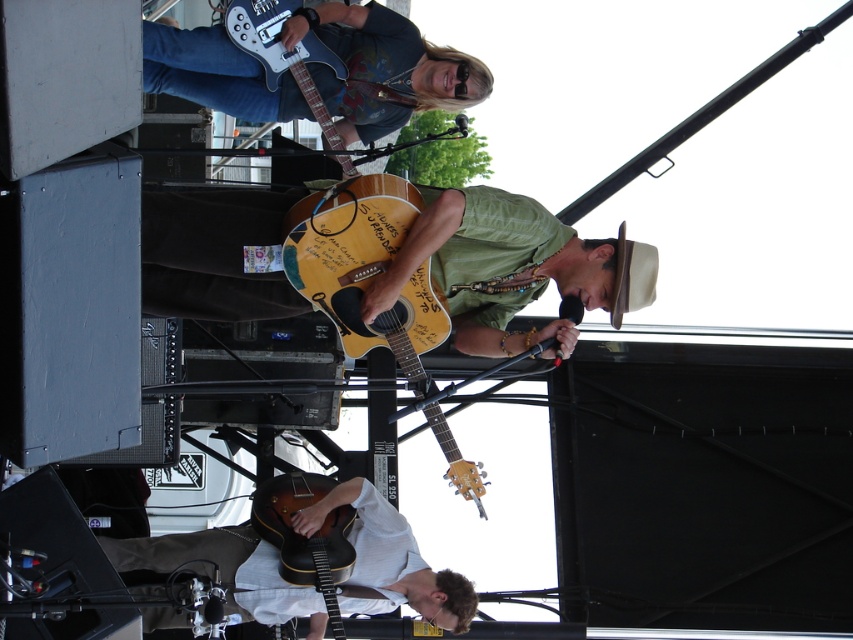
Question: Which object is the farthest from the vintage brown guitar at lower center?

Choices:
 (A) wooden acoustic guitar at lower center
 (B) matte yellow acoustic guitar at center
 (C) metallic silver electric guitar at upper center
 (D) yellow wood guitar at center

Answer: (C)

Question: Which object is the closest to the wooden acoustic guitar at lower center?

Choices:
 (A) vintage brown guitar at lower center
 (B) matte yellow acoustic guitar at center
 (C) yellow wood guitar at center

Answer: (A)

Question: Is the position of wooden acoustic guitar at lower center less distant than that of vintage brown guitar at lower center?

Choices:
 (A) no
 (B) yes

Answer: (A)

Question: Which of the following is the closest to the observer?

Choices:
 (A) matte yellow acoustic guitar at center
 (B) yellow wood guitar at center
 (C) matte blue guitar at upper left
 (D) metallic silver electric guitar at upper center

Answer: (C)

Question: Is matte yellow acoustic guitar at center wider than wooden acoustic guitar at lower center?

Choices:
 (A) no
 (B) yes

Answer: (B)

Question: Can you confirm if wooden acoustic guitar at lower center is wider than vintage brown guitar at lower center?

Choices:
 (A) no
 (B) yes

Answer: (B)